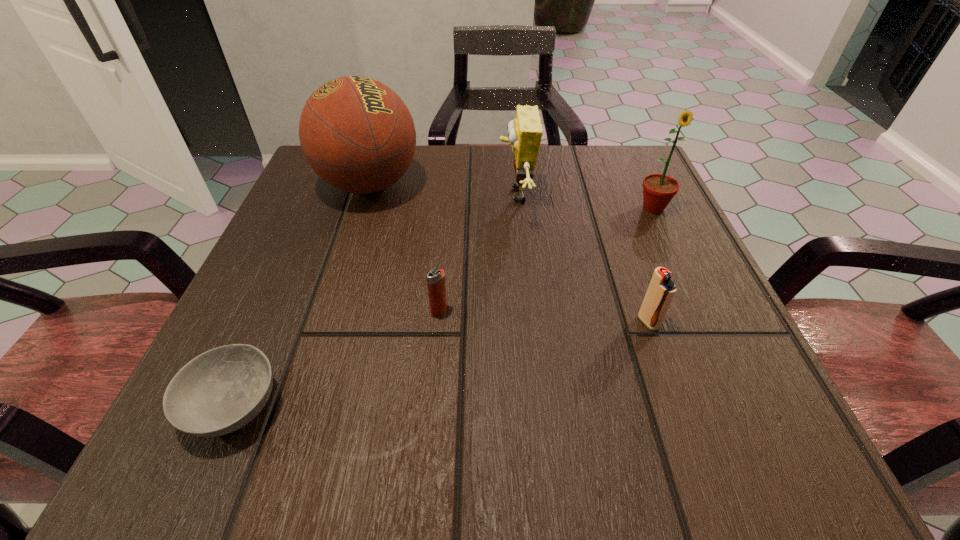
Where is `vacant space located 0.280m on the right of the basketball`? vacant space located 0.280m on the right of the basketball is located at coordinates (555, 185).

Where is `free space located 0.190m on the face of the rightmost object`? This screenshot has width=960, height=540. free space located 0.190m on the face of the rightmost object is located at coordinates (692, 291).

At what (x,y) coordinates should I click in order to perform the action: click on free spot located 0.180m on the face of the third object from right to left. Please return your answer as a coordinate pair (x, y). This screenshot has width=960, height=540. Looking at the image, I should click on (409, 195).

You are a GUI agent. You are given a task and a screenshot of the screen. Output one action in this format:
    pyautogui.click(x=<x>, y=<y>)
    Task: Click on the blank space located on the face of the third object from right to left
    This screenshot has width=960, height=540.
    Given the screenshot: What is the action you would take?
    pyautogui.click(x=458, y=195)

Where is `free region located on the face of the third object from right to left`? This screenshot has width=960, height=540. free region located on the face of the third object from right to left is located at coordinates (419, 195).

Where is `free space located on the back of the right igniter`? Image resolution: width=960 pixels, height=540 pixels. free space located on the back of the right igniter is located at coordinates (630, 268).

Locate an element on the screen. The width and height of the screenshot is (960, 540). vacant space located 0.160m on the front of the second shortest object is located at coordinates (430, 415).

The image size is (960, 540). In order to click on vacant space located 0.200m on the back of the nearest object in this screenshot , I will do (294, 265).

Locate an element on the screen. This screenshot has height=540, width=960. basketball located in the far edge section of the desktop is located at coordinates (356, 133).

You are a GUI agent. You are given a task and a screenshot of the screen. Output one action in this format:
    pyautogui.click(x=<x>, y=<y>)
    Task: Click on the sunflower at the far edge
    The height and width of the screenshot is (540, 960).
    Given the screenshot: What is the action you would take?
    (x=658, y=189)